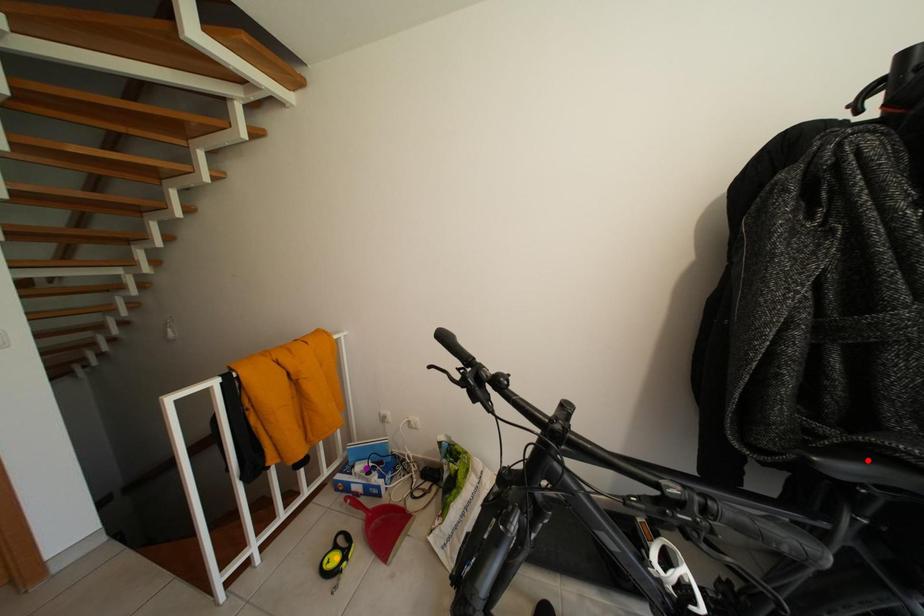
Order these from farthest to nearest:
red point | orange point | purple point

purple point → orange point → red point